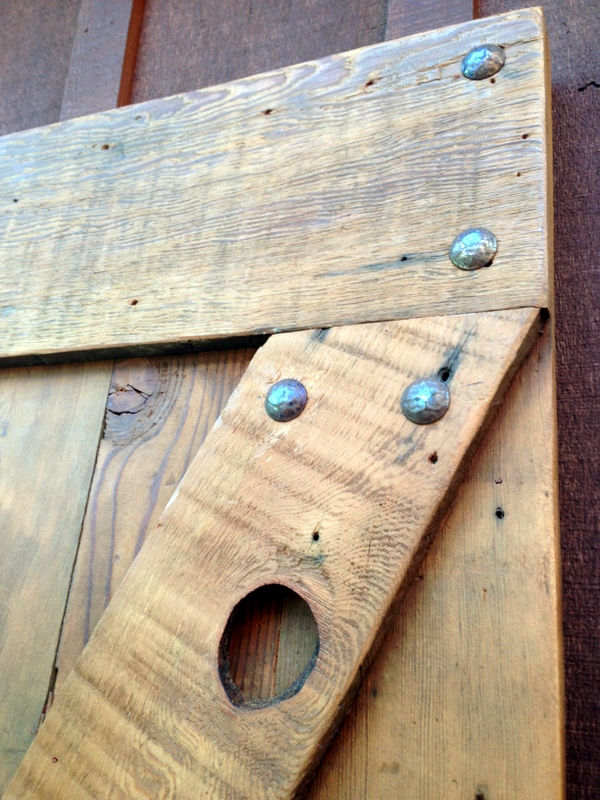
Find the location of a particular element. bench is located at coordinates (308, 534).